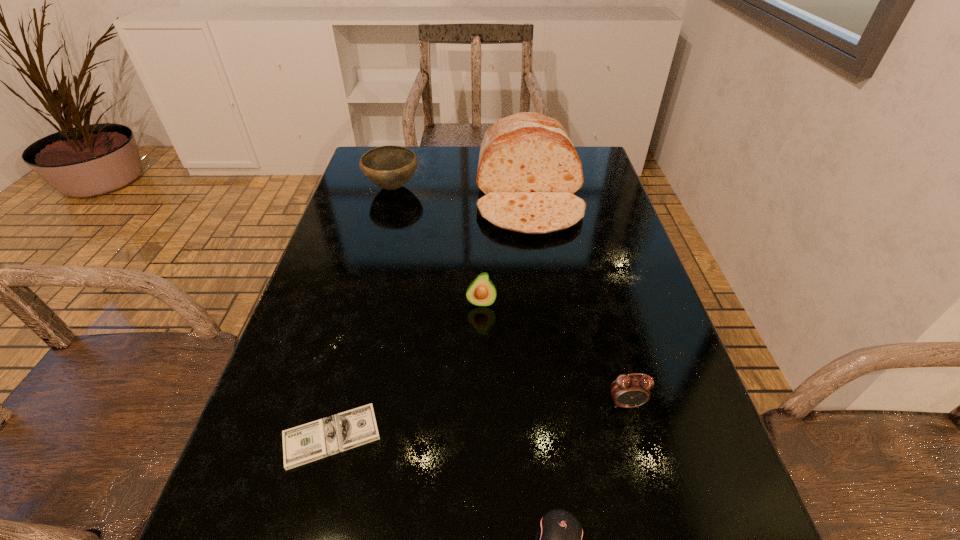
Identify the location of the tallest object. Image resolution: width=960 pixels, height=540 pixels. (528, 170).

At what (x,y) coordinates should I click in order to perform the action: click on bowl. Please return your answer as a coordinate pair (x, y). Looking at the image, I should click on (389, 167).

The height and width of the screenshot is (540, 960). I want to click on the third farthest object, so [x=481, y=292].

The image size is (960, 540). Identify the location of alarm clock. (628, 391).

Image resolution: width=960 pixels, height=540 pixels. Identify the location of the shortest object. (340, 432).

This screenshot has height=540, width=960. Identify the location of free space located 0.070m at the sliced end of the bread. pos(538,260).

Where is `vacant space located 0.240m on the right of the bowl`? vacant space located 0.240m on the right of the bowl is located at coordinates (504, 187).

Image resolution: width=960 pixels, height=540 pixels. In order to click on free space located 0.370m on the cut side of the fourth nearest object in this screenshot , I will do `click(482, 493)`.

Find the location of a particular element. The height and width of the screenshot is (540, 960). free region located on the face of the alarm clock is located at coordinates (657, 518).

You are a GUI agent. You are given a task and a screenshot of the screen. Output one action in this format:
    pyautogui.click(x=<x>, y=<y>)
    Task: Click on the free space located 0.100m on the back of the shortest object
    This screenshot has height=540, width=960.
    Given the screenshot: What is the action you would take?
    pyautogui.click(x=352, y=359)